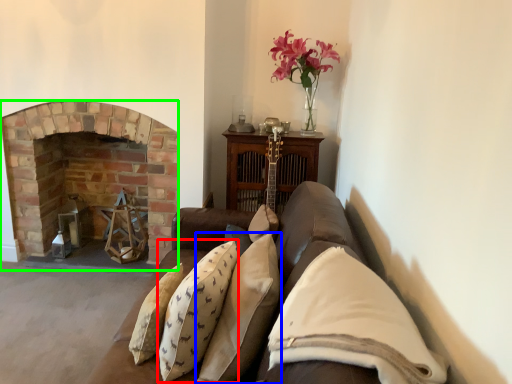
Question: Which is nearer to the pillow (highlighted by a red box)? pillow (highlighted by a blue box) or fireplace (highlighted by a green box).

Choices:
 (A) pillow
 (B) fireplace

Answer: (A)